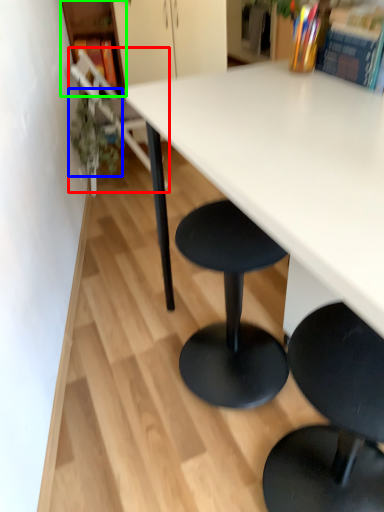
Question: Which is farther away from chair (highlighted by a red box)? plant (highlighted by a blue box) or shelf (highlighted by a green box)?

Choices:
 (A) plant
 (B) shelf

Answer: (B)